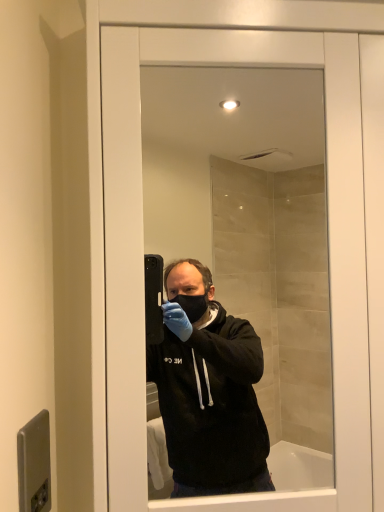
Question: Would you consider metallic gray door handle at lower left to be distant from transparent glass mirror at center?

Choices:
 (A) yes
 (B) no

Answer: (A)

Question: From the image's perspective, is metallic gray door handle at lower left below transparent glass mirror at center?

Choices:
 (A) yes
 (B) no

Answer: (A)

Question: Does metallic gray door handle at lower left have a lesser width compared to transparent glass mirror at center?

Choices:
 (A) yes
 (B) no

Answer: (A)

Question: Is the depth of metallic gray door handle at lower left less than that of transparent glass mirror at center?

Choices:
 (A) yes
 (B) no

Answer: (A)

Question: Is transparent glass mirror at center inside metallic gray door handle at lower left?

Choices:
 (A) no
 (B) yes

Answer: (A)

Question: Considering the relative sizes of metallic gray door handle at lower left and transparent glass mirror at center in the image provided, is metallic gray door handle at lower left shorter than transparent glass mirror at center?

Choices:
 (A) no
 (B) yes

Answer: (B)

Question: Does transparent glass mirror at center have a larger size compared to metallic gray door handle at lower left?

Choices:
 (A) no
 (B) yes

Answer: (B)

Question: Is transparent glass mirror at center closer to the viewer compared to metallic gray door handle at lower left?

Choices:
 (A) yes
 (B) no

Answer: (B)

Question: From the image's perspective, does transparent glass mirror at center appear lower than metallic gray door handle at lower left?

Choices:
 (A) no
 (B) yes

Answer: (A)

Question: Is transparent glass mirror at center looking in the opposite direction of metallic gray door handle at lower left?

Choices:
 (A) no
 (B) yes

Answer: (A)

Question: From a real-world perspective, is transparent glass mirror at center physically above metallic gray door handle at lower left?

Choices:
 (A) no
 (B) yes

Answer: (B)

Question: Are transparent glass mirror at center and metallic gray door handle at lower left located far from each other?

Choices:
 (A) no
 (B) yes

Answer: (B)

Question: Is metallic gray door handle at lower left inside the boundaries of transparent glass mirror at center, or outside?

Choices:
 (A) outside
 (B) inside

Answer: (A)